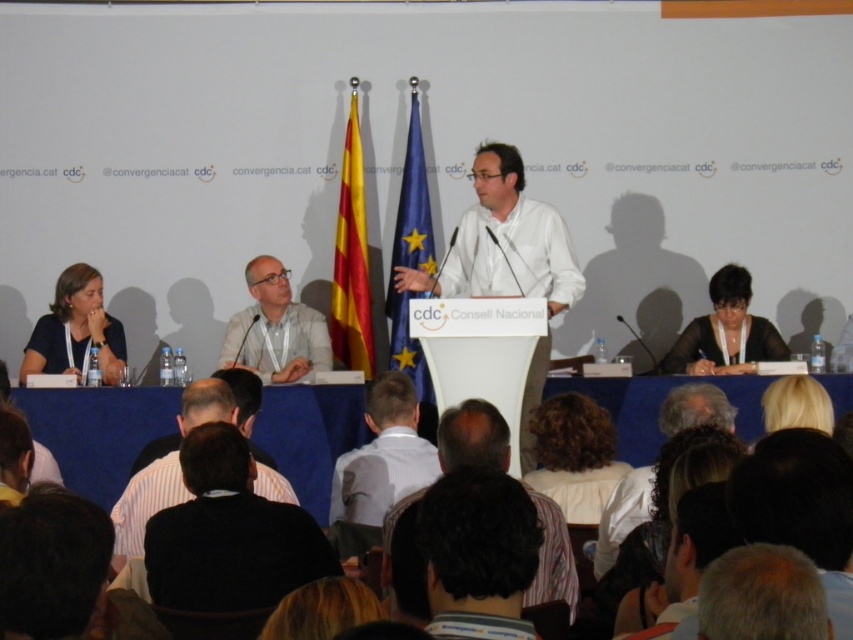
Question: Is black shirt at center thinner than white striped shirt at center?

Choices:
 (A) no
 (B) yes

Answer: (A)

Question: Estimate the real-world distances between objects in this image. Which object is closer to the brown striped shirt at center?

Choices:
 (A) black striped shirt at center
 (B) matte black woman at left

Answer: (A)

Question: Is white curly hair at center further to the viewer compared to black striped shirt at center?

Choices:
 (A) no
 (B) yes

Answer: (B)

Question: Can you confirm if white curly hair at center is positioned above white shirt at center?

Choices:
 (A) yes
 (B) no

Answer: (B)

Question: Which point is farther from the camera taking this photo?

Choices:
 (A) (233, 362)
 (B) (593, 556)
 (C) (498, 452)

Answer: (A)

Question: Among these objects, which one is nearest to the camera?

Choices:
 (A) dark brown hair at center
 (B) blonde hair at lower right
 (C) matte black woman at left
 (D) black striped shirt at center

Answer: (A)